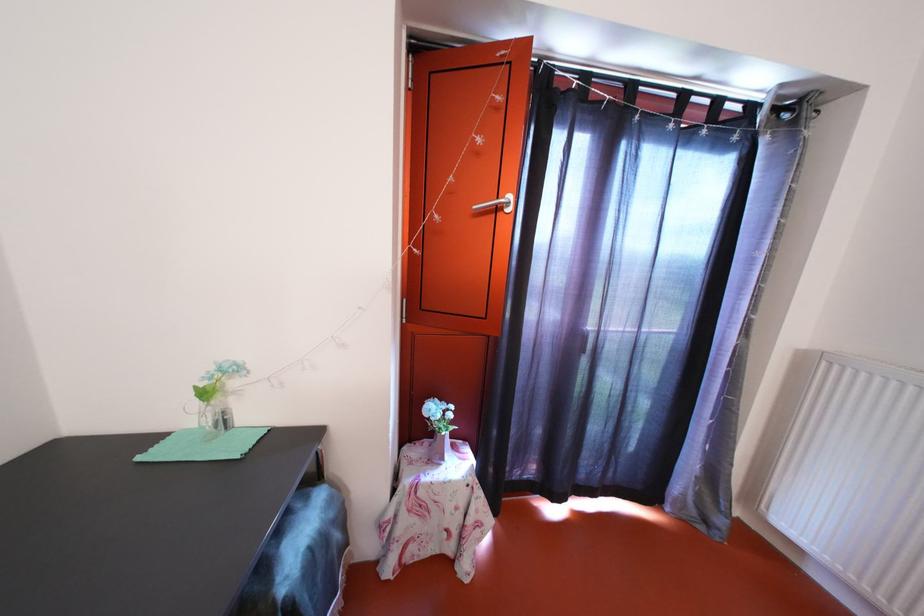
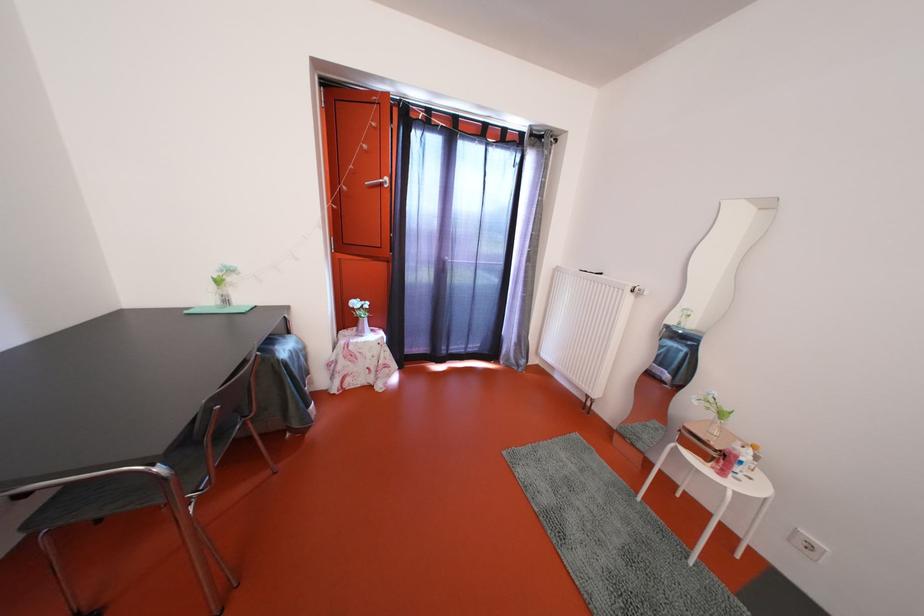
Question: What movement of the cameraman would produce the second image?

Choices:
 (A) Left
 (B) Right
 (C) Forward
 (D) Backward

Answer: (D)